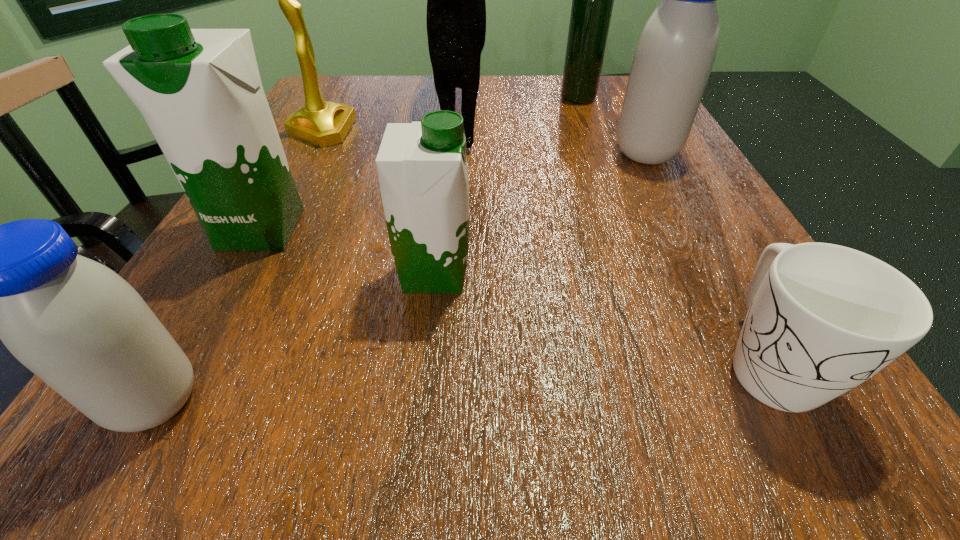
This screenshot has height=540, width=960. I want to click on black cat, so pos(456,9).

Find the location of a particular element. This screenshot has width=960, height=540. liquor is located at coordinates (592, 0).

I want to click on golden award, so click(x=321, y=123).

Where is `the rightmost soya milk`? Image resolution: width=960 pixels, height=540 pixels. the rightmost soya milk is located at coordinates (673, 59).

Where is `the farthest soya milk`? The image size is (960, 540). the farthest soya milk is located at coordinates (673, 59).

Where is `the left green soya milk`? The image size is (960, 540). the left green soya milk is located at coordinates (x=199, y=90).

Identify the location of the smaller green soya milk. Image resolution: width=960 pixels, height=540 pixels. (422, 169).

This screenshot has width=960, height=540. I want to click on the third soya milk from left to right, so click(x=422, y=169).

Locate an element on the screen. the left blue soya milk is located at coordinates (81, 328).

At what (x,y) coordinates should I click in order to perform the action: click on the smaller blue soya milk. Please return your answer as a coordinate pair (x, y). The image size is (960, 540). Looking at the image, I should click on click(x=81, y=328).